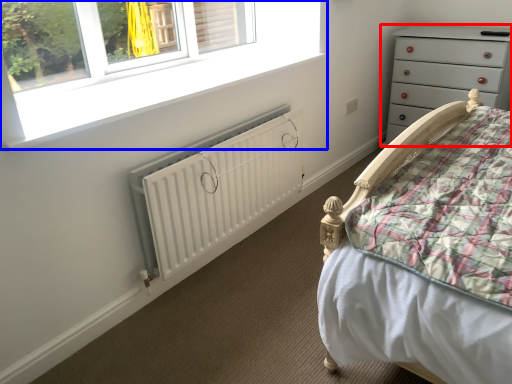
Question: Among these objects, which one is nearest to the camera, chest of drawers (highlighted by a red box) or window (highlighted by a blue box)?

Choices:
 (A) chest of drawers
 (B) window

Answer: (B)